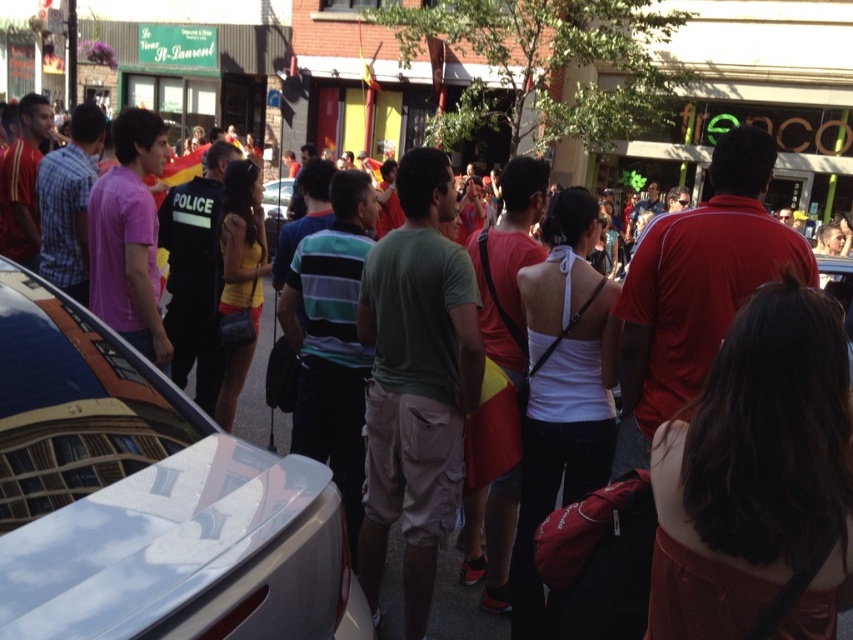
Question: Is shiny silver car at center-left positioned in front of green cotton t-shirt at center?

Choices:
 (A) no
 (B) yes

Answer: (B)

Question: Which of the following is the closest to the observer?

Choices:
 (A) green cotton t-shirt at center
 (B) shiny silver car at center-left

Answer: (B)

Question: Is shiny silver car at center-left smaller than green cotton t-shirt at center?

Choices:
 (A) yes
 (B) no

Answer: (B)

Question: Which point is closer to the camera?

Choices:
 (A) (428, 241)
 (B) (257, 554)

Answer: (B)

Question: Is shiny silver car at center-left to the right of green cotton t-shirt at center from the viewer's perspective?

Choices:
 (A) yes
 (B) no

Answer: (B)